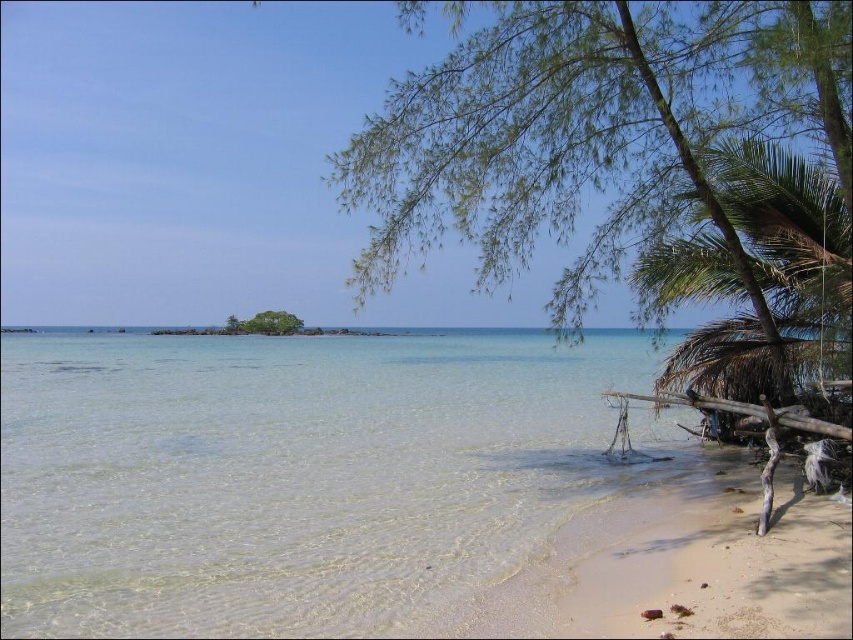
You are standing on the beach and want to find the wider tree between the green leafy tree at right and the green leafy tree at center. Which one should you look towards?

The green leafy tree at center is wider than the green leafy tree at right, so you should look towards the green leafy tree at center.